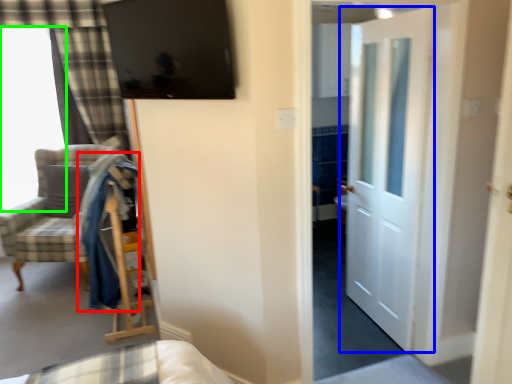
Question: Considering the real-world distances, which object is farthest from robe (highlighted by a red box)? door (highlighted by a blue box) or window (highlighted by a green box)?

Choices:
 (A) door
 (B) window

Answer: (B)